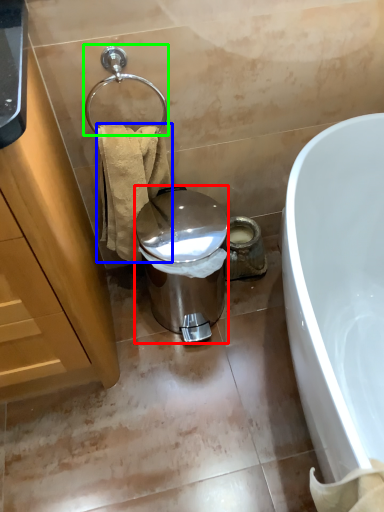
Question: Based on their relative distances, which object is farther from trash bin/can (highlighted by a red box)? Choose from towel/napkin (highlighted by a blue box) and shower (highlighted by a green box).

Choices:
 (A) towel/napkin
 (B) shower

Answer: (B)